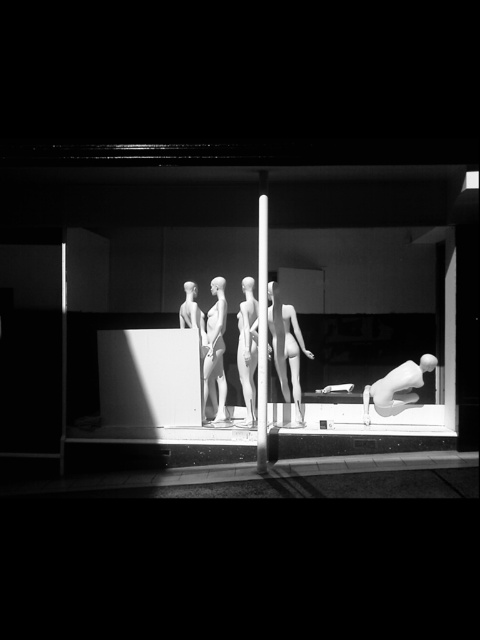
You are a delivery person who needs to place a small package between the white glossy pole at center and the matte white mannequin at center. Can you fit the package in that space?

The white glossy pole at center is smaller than the matte white mannequin at center, so there is enough space to fit the small package between them.

Based on the photo, you are standing in front of the storefront window display at night. There are two points marked in the scene. The first point is at coordinates point (257,317) and the second point is at point (218,371). Which of these two points is closer to you as you face the window?

Point (257,317) is in front of point (218,371), so it is closer to you as you face the window.